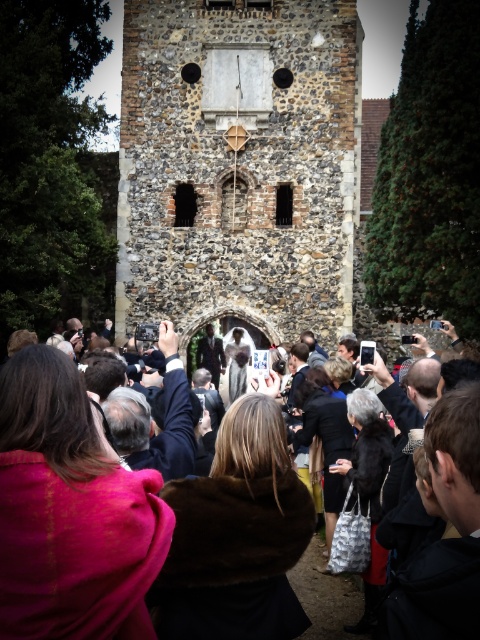
Question: Can you confirm if stone clock tower at center is positioned to the right of dark brown fur coat at center?

Choices:
 (A) yes
 (B) no

Answer: (A)

Question: Which point appears closest to the camera in this image?

Choices:
 (A) (345, 186)
 (B) (120, 470)

Answer: (B)

Question: Is stone clock tower at center closer to the viewer compared to dark brown fur coat at center?

Choices:
 (A) no
 (B) yes

Answer: (A)

Question: Where is stone clock tower at center located in relation to dark brown fur coat at center in the image?

Choices:
 (A) left
 (B) right

Answer: (B)

Question: Which of the following is the farthest from the observer?

Choices:
 (A) (276, 218)
 (B) (167, 380)

Answer: (A)